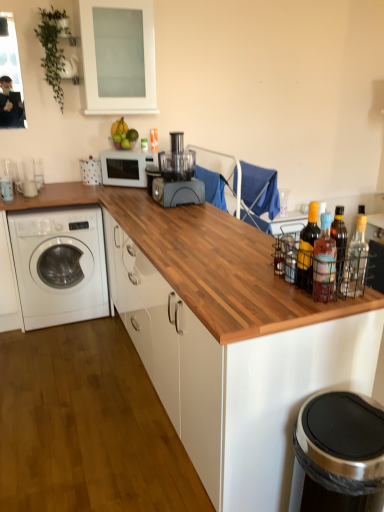
Question: From a real-world perspective, is clear glass bottle at right, the third bottle in the left-to-right sequence, below wooden at center?

Choices:
 (A) yes
 (B) no

Answer: (A)

Question: Can you confirm if clear glass bottle at right, placed as the 1th bottle when sorted from right to left, is bigger than wooden at center?

Choices:
 (A) no
 (B) yes

Answer: (A)

Question: Does clear glass bottle at right, placed as the 1th bottle when sorted from right to left, have a smaller size compared to wooden at center?

Choices:
 (A) no
 (B) yes

Answer: (B)

Question: From a real-world perspective, is clear glass bottle at right, the third bottle in the left-to-right sequence, physically above wooden at center?

Choices:
 (A) no
 (B) yes

Answer: (A)

Question: Does clear glass bottle at right, which is counted as the first bottle, starting from the back, appear on the left side of wooden at center?

Choices:
 (A) yes
 (B) no

Answer: (B)

Question: Does clear glass bottle at right, the third bottle in the left-to-right sequence, appear on the right side of wooden at center?

Choices:
 (A) yes
 (B) no

Answer: (A)

Question: Is matte gray blender at center surrounding transparent glass cabinet at upper center?

Choices:
 (A) yes
 (B) no

Answer: (B)

Question: Does matte gray blender at center have a lesser height compared to transparent glass cabinet at upper center?

Choices:
 (A) yes
 (B) no

Answer: (A)

Question: Could you tell me if matte gray blender at center is facing transparent glass cabinet at upper center?

Choices:
 (A) no
 (B) yes

Answer: (A)

Question: Is matte gray blender at center to the right of transparent glass cabinet at upper center from the viewer's perspective?

Choices:
 (A) no
 (B) yes

Answer: (B)

Question: Can we say matte gray blender at center lies outside transparent glass cabinet at upper center?

Choices:
 (A) no
 (B) yes

Answer: (B)

Question: Is matte gray blender at center turned away from transparent glass cabinet at upper center?

Choices:
 (A) yes
 (B) no

Answer: (B)

Question: Are wooden at center and matte yellow glass bottle at right, the 1th bottle positioned from the left, located far from each other?

Choices:
 (A) yes
 (B) no

Answer: (B)